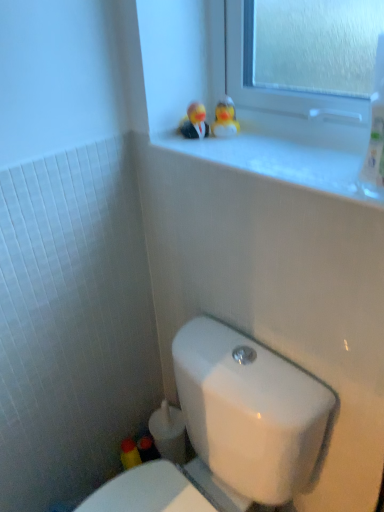
At what (x,y) coordinates should I click in order to perform the action: click on vacant space in front of rubber duckies at upper center, the 2th miniature when ordered from left to right. Please return your answer as a coordinate pair (x, y). Image resolution: width=384 pixels, height=512 pixels. Looking at the image, I should click on (247, 151).